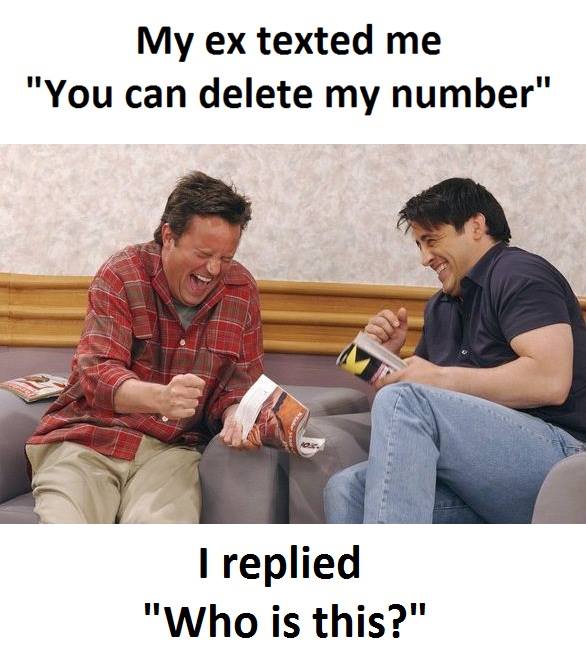
Image resolution: width=586 pixels, height=668 pixels. What are the coordinates of `magazines` in the screenshot? It's located at (369, 365), (272, 405), (49, 381).